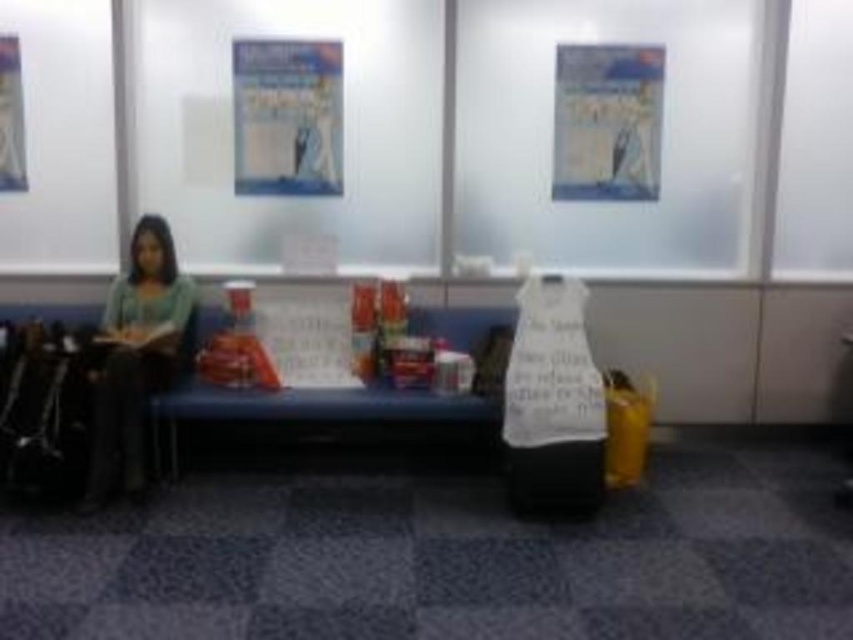
You are a person standing in the waiting area and you want to know which object is taller between the matte green sweater at left and the matte paper poster at upper center. Based on the scene description, can you determine which one is taller?

The matte green sweater at left is taller than the matte paper poster at upper center according to the description.

You are an interior designer assessing the layout of this waiting area. You need to determine which poster is better suited for a prominent display position. Considering their sizes, which poster between the matte paper poster at upper center and the metallic silver poster at upper left should be placed in a more visible location?

The matte paper poster at upper center is much taller than the metallic silver poster at upper left, so it should be placed in a more visible location due to its larger size.